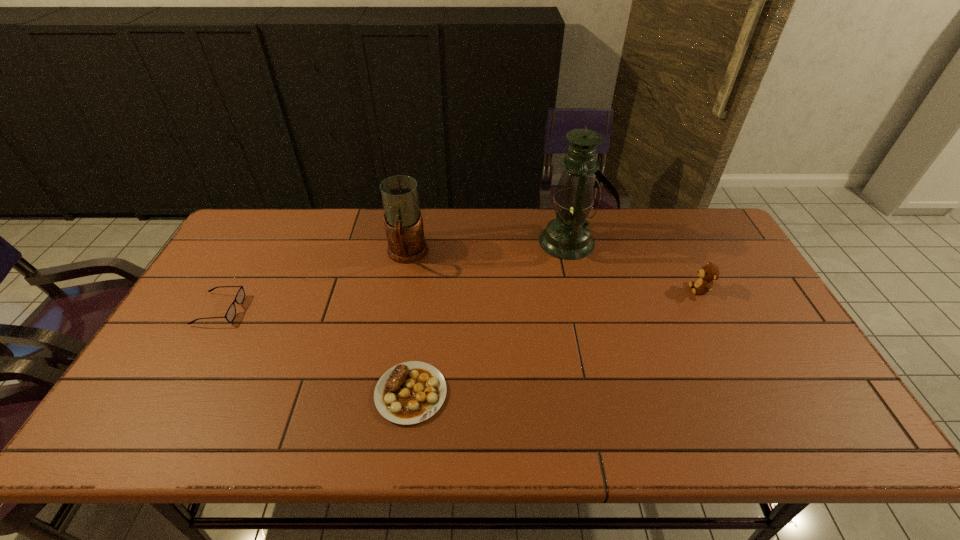
Where is `vacant space situated 0.210m on the face of the teddy bear`? vacant space situated 0.210m on the face of the teddy bear is located at coordinates (619, 289).

Where is `free space located 0.120m on the face of the teddy bear`? This screenshot has height=540, width=960. free space located 0.120m on the face of the teddy bear is located at coordinates (650, 289).

Identify the location of vacant area located on the face of the teddy bear. The width and height of the screenshot is (960, 540). (596, 289).

You are a GUI agent. You are given a task and a screenshot of the screen. Output one action in this format:
    pyautogui.click(x=<x>, y=<y>)
    Task: Click on the vacant area situated on the front-facing side of the spectacles
    
    Given the screenshot: What is the action you would take?
    pyautogui.click(x=376, y=309)

Locate an element on the screen. Image resolution: width=960 pixels, height=540 pixels. free space located on the back of the steak is located at coordinates (419, 335).

Image resolution: width=960 pixels, height=540 pixels. Find the location of `oil lamp positioned at the far edge`. oil lamp positioned at the far edge is located at coordinates (567, 236).

Locate an element on the screen. Image resolution: width=960 pixels, height=540 pixels. pitcher located at the far edge is located at coordinates coord(403,220).

I want to click on object that is at the near edge, so click(x=411, y=392).

Find the location of `object at the left edge`. object at the left edge is located at coordinates (240, 296).

Where is `object at the right edge`? object at the right edge is located at coordinates (708, 273).